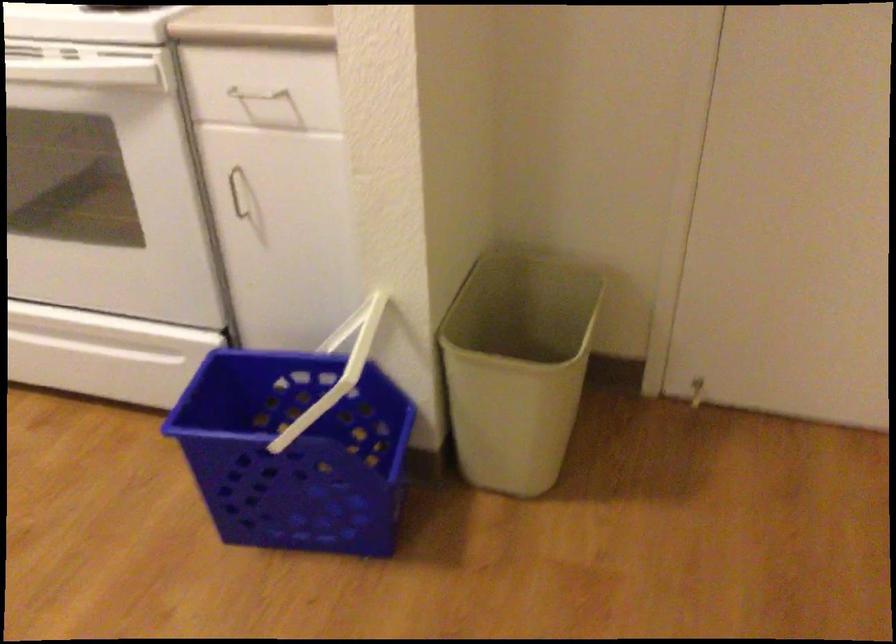
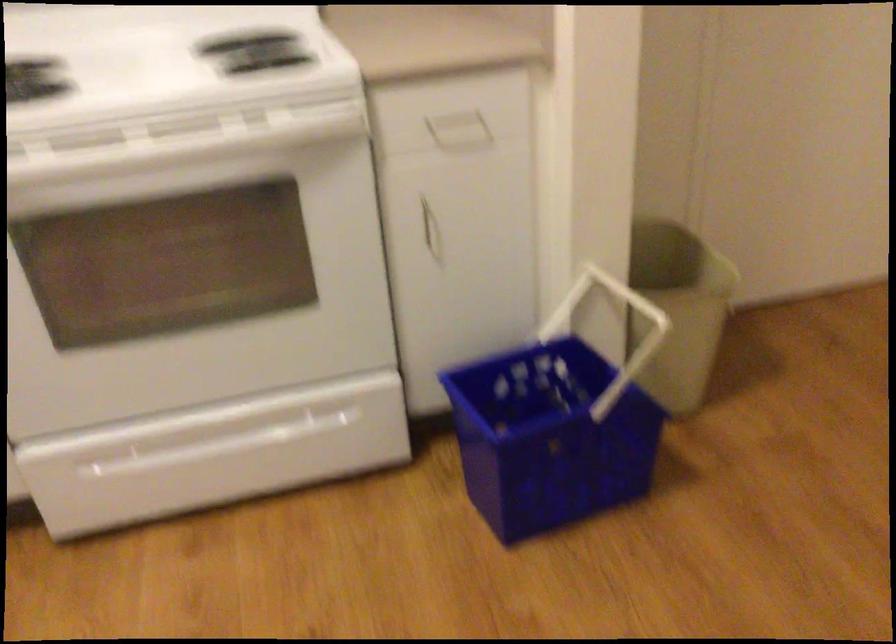
Find the pixel in the second image that matches point (418, 373) in the first image.

(616, 330)